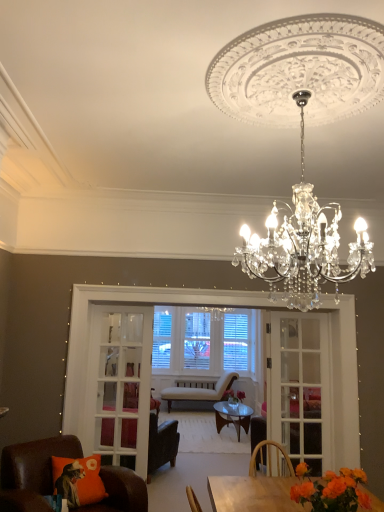
The width and height of the screenshot is (384, 512). Find the location of `light beige fabric chair at center, the third chair in the front-to-back sequence`. light beige fabric chair at center, the third chair in the front-to-back sequence is located at coordinates (198, 393).

I want to click on brown leather chair at lower left, arranged as the 3th chair when viewed from the back, so click(x=32, y=472).

The image size is (384, 512). Identify the location of orange fabric pillow at lower left. (78, 480).

Image resolution: width=384 pixels, height=512 pixels. Describe the element at coordinates (119, 384) in the screenshot. I see `white glass screen door at center, which is the second screen door in right-to-left order` at that location.

Measure the distance between point (x=328, y=400) and camera.

Point (x=328, y=400) is 13.90 feet from camera.

The height and width of the screenshot is (512, 384). Identify the location of light beige fabric chair at center, arranged as the first chair when viewed from the back. (198, 393).

Would you say clear crystal chandelier at upper center is inside or outside white glass screen door at center, positioned as the first screen door in left-to-right order?

clear crystal chandelier at upper center exists outside the volume of white glass screen door at center, positioned as the first screen door in left-to-right order.

Could you tell me if clear crystal chandelier at upper center is turned towards white glass screen door at center, which is the second screen door in right-to-left order?

Yes, clear crystal chandelier at upper center is aimed at white glass screen door at center, which is the second screen door in right-to-left order.

Which object is positioned more to the right, clear crystal chandelier at upper center or white glass screen door at center, which is the second screen door in right-to-left order?

clear crystal chandelier at upper center is more to the right.

Which object is thinner, clear crystal chandelier at upper center or white glass screen door at center, positioned as the first screen door in left-to-right order?

white glass screen door at center, positioned as the first screen door in left-to-right order, is thinner.

From a real-world perspective, which is physically above, pink matte vase at center, which is counted as the 1th flower, starting from the back, or brown leather chair at lower left, placed as the first chair when sorted from front to back?

pink matte vase at center, which is counted as the 1th flower, starting from the back.

How distant is pink matte vase at center, arranged as the 2th flower when viewed from the top, from brown leather chair at lower left, placed as the first chair when sorted from front to back?

They are 13.83 feet apart.

Between point (227, 393) and point (28, 447), which one is positioned in front?

The point (28, 447) is more forward.

Based on their sizes in the image, would you say pink matte vase at center, which is counted as the 1th flower, starting from the back, is bigger or smaller than brown leather chair at lower left, arranged as the 3th chair when viewed from the back?

In the image, pink matte vase at center, which is counted as the 1th flower, starting from the back, appears to be smaller than brown leather chair at lower left, arranged as the 3th chair when viewed from the back.

Is there a large distance between orange fabric pillow at lower left and white glass screen door at center, which is the first screen door from right to left?

Indeed, orange fabric pillow at lower left is not near white glass screen door at center, which is the first screen door from right to left.

Considering the sizes of objects orange fabric pillow at lower left and white glass screen door at center, which is the second screen door from left to right, in the image provided, who is bigger, orange fabric pillow at lower left or white glass screen door at center, which is the second screen door from left to right,?

With larger size is orange fabric pillow at lower left.

Identify the location of pillow to the left of white glass screen door at center, which is the first screen door from right to left. The height and width of the screenshot is (512, 384). (78, 480).

Considering the sizes of objects clear crystal chandelier at upper center and light beige fabric chair at center, the third chair in the front-to-back sequence, in the image provided, who is smaller, clear crystal chandelier at upper center or light beige fabric chair at center, the third chair in the front-to-back sequence,?

With smaller size is light beige fabric chair at center, the third chair in the front-to-back sequence.

Is clear crystal chandelier at upper center inside or outside of light beige fabric chair at center, the third chair in the front-to-back sequence?

clear crystal chandelier at upper center is not enclosed by light beige fabric chair at center, the third chair in the front-to-back sequence.

You are a GUI agent. You are given a task and a screenshot of the screen. Output one action in this format:
    pyautogui.click(x=<x>, y=<y>)
    Task: Click on the 3rd chair directly beneath the clear crystal chandelier at upper center (from a real-world perspective)
    The height and width of the screenshot is (512, 384).
    Given the screenshot: What is the action you would take?
    pyautogui.click(x=198, y=393)

Is light beige fabric chair at center, the third chair in the front-to-back sequence, located outside pink matte vase at center, arranged as the 2th flower when viewed from the top?

light beige fabric chair at center, the third chair in the front-to-back sequence, lies outside pink matte vase at center, arranged as the 2th flower when viewed from the top,'s area.

Considering the relative sizes of light beige fabric chair at center, the third chair in the front-to-back sequence, and pink matte vase at center, arranged as the 2th flower when viewed from the top, in the image provided, is light beige fabric chair at center, the third chair in the front-to-back sequence, thinner than pink matte vase at center, arranged as the 2th flower when viewed from the top,?

Incorrect, the width of light beige fabric chair at center, the third chair in the front-to-back sequence, is not less than that of pink matte vase at center, arranged as the 2th flower when viewed from the top.

From a real-world perspective, which object stands above the other?

In real-world perspective, pink matte vase at center, acting as the 2th flower starting from the front, is above.

Does orange fabric pillow at lower left appear on the right side of clear crystal chandelier at upper center?

No, orange fabric pillow at lower left is not to the right of clear crystal chandelier at upper center.

Is orange fabric pillow at lower left located outside clear crystal chandelier at upper center?

Yes, orange fabric pillow at lower left is outside of clear crystal chandelier at upper center.

From a real-world perspective, does orange fabric pillow at lower left sit lower than clear crystal chandelier at upper center?

Yes, from a real-world perspective, orange fabric pillow at lower left is under clear crystal chandelier at upper center.

Considering the relative sizes of orange fabric pillow at lower left and clear crystal chandelier at upper center in the image provided, is orange fabric pillow at lower left smaller than clear crystal chandelier at upper center?

Correct, orange fabric pillow at lower left occupies less space than clear crystal chandelier at upper center.

Is there a large distance between orange fabric pillow at lower left and brown leather chair at lower left, arranged as the 3th chair when viewed from the back?

Actually, orange fabric pillow at lower left and brown leather chair at lower left, arranged as the 3th chair when viewed from the back, are a little close together.

How far apart are orange fabric pillow at lower left and brown leather chair at lower left, arranged as the 3th chair when viewed from the back?

7.56 inches.

Who is smaller, orange fabric pillow at lower left or brown leather chair at lower left, arranged as the 3th chair when viewed from the back?

orange fabric pillow at lower left.

Considering the positions of point (55, 472) and point (48, 478), is point (55, 472) closer or farther from the camera than point (48, 478)?

Point (55, 472) appears to be farther away from the viewer than point (48, 478).

Where is `screen door on the left of clear crystal chandelier at upper center`? This screenshot has height=512, width=384. screen door on the left of clear crystal chandelier at upper center is located at coordinates (119, 384).

Image resolution: width=384 pixels, height=512 pixels. I want to click on flower below the brown leather chair at lower left, placed as the first chair when sorted from front to back (from the image's perspective), so click(x=234, y=395).

Based on their spatial positions, is orange fabric pillow at lower left or orange matte flower at lower right, acting as the first flower starting from the top, closer to leather armchair at center, the second chair from the front?

orange fabric pillow at lower left is positioned closer to the anchor leather armchair at center, the second chair from the front.

Considering their positions, is orange fabric pillow at lower left positioned closer to light beige fabric chair at center, arranged as the first chair when viewed from the back, than brown leather chair at lower left, placed as the first chair when sorted from front to back?

Among the two, brown leather chair at lower left, placed as the first chair when sorted from front to back, is located nearer to light beige fabric chair at center, arranged as the first chair when viewed from the back.

In the scene shown: When comparing their distances from white glass screen door at center, positioned as the first screen door in left-to-right order, does orange matte flower at lower right, acting as the 2th flower starting from the back, or leather armchair at center, the second chair from the front, seem further?

orange matte flower at lower right, acting as the 2th flower starting from the back.

Based on their spatial positions, is white glass screen door at center, which is the second screen door in right-to-left order, or pink matte vase at center, arranged as the first flower when ordered from the bottom, closer to light beige fabric chair at center, the third chair in the front-to-back sequence?

The object closer to light beige fabric chair at center, the third chair in the front-to-back sequence, is pink matte vase at center, arranged as the first flower when ordered from the bottom.

When comparing their distances from brown leather chair at lower left, arranged as the 3th chair when viewed from the back, does white glass screen door at center, which is the second screen door in right-to-left order, or white glass screen door at center, which is the second screen door from left to right, seem closer?

The object closer to brown leather chair at lower left, arranged as the 3th chair when viewed from the back, is white glass screen door at center, which is the second screen door in right-to-left order.

When comparing their distances from orange matte flower at lower right, acting as the 2th flower starting from the back, does leather armchair at center, the second chair from the front, or white glass screen door at center, which is the second screen door in right-to-left order, seem further?

leather armchair at center, the second chair from the front, is positioned further to the anchor orange matte flower at lower right, acting as the 2th flower starting from the back.

In the scene shown: Considering their positions, is clear crystal chandelier at upper center positioned further to light beige fabric chair at center, the third chair in the front-to-back sequence, than leather armchair at center, the 2th chair in the back-to-front sequence?

Based on the image, clear crystal chandelier at upper center appears to be further to light beige fabric chair at center, the third chair in the front-to-back sequence.

Considering their positions, is orange matte flower at lower right, acting as the 2th flower starting from the back, positioned further to white glass screen door at center, positioned as the first screen door in left-to-right order, than white glass screen door at center, which is the first screen door from right to left?

orange matte flower at lower right, acting as the 2th flower starting from the back, is positioned further to the anchor white glass screen door at center, positioned as the first screen door in left-to-right order.

What are the coordinates of `pillow between brown leather chair at lower left, placed as the first chair when sorted from front to back, and light beige fabric chair at center, arranged as the first chair when viewed from the back, along the z-axis` in the screenshot? It's located at (78, 480).

Locate an element on the screen. The width and height of the screenshot is (384, 512). screen door positioned between clear crystal chandelier at upper center and white glass screen door at center, which is the first screen door from right to left, from near to far is located at coordinates (119, 384).

Where is `screen door located between leather armchair at center, the second chair from the front, and white glass screen door at center, which is the first screen door from right to left, in the left-right direction`? This screenshot has height=512, width=384. screen door located between leather armchair at center, the second chair from the front, and white glass screen door at center, which is the first screen door from right to left, in the left-right direction is located at coordinates 119,384.

I want to click on pillow between orange matte flower at lower right, acting as the 2th flower starting from the back, and light beige fabric chair at center, arranged as the first chair when viewed from the back, from front to back, so point(78,480).